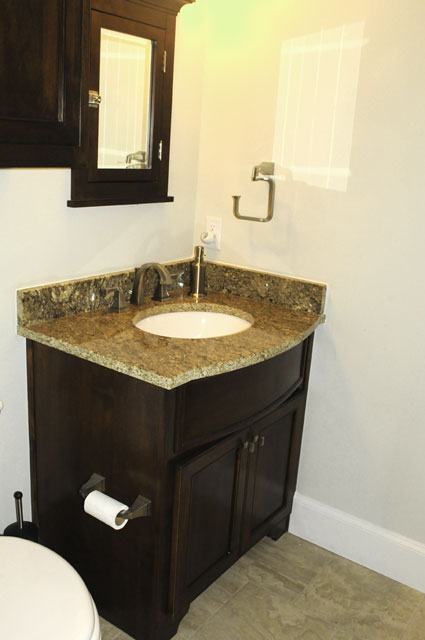
Find the location of a particular element. Image resolution: width=425 pixels, height=640 pixels. tap is located at coordinates (139, 275).